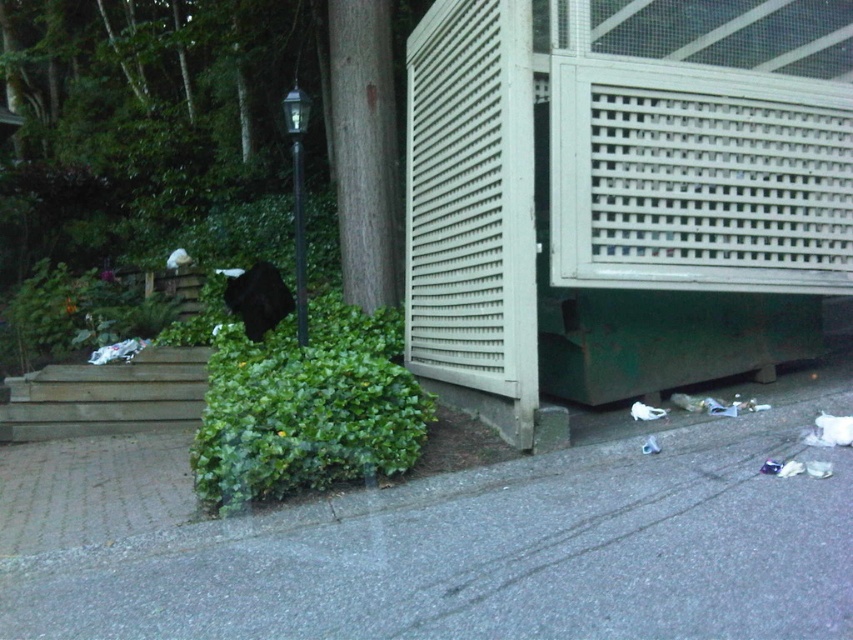
In the scene shown: You are standing at the point marked by the coordinates point (614, 205), which is the green textured porch at lower right. Looking around, you notice a black lamppost. In which direction relative to your current position is the black lamppost located?

The black lamppost is to the left of the green textured porch at lower right.

You are a delivery robot that needs to move a large package from the gray concrete pavement at lower center to the wooden stairs at lower left. Can you fit the package through the space between them?

The gray concrete pavement at lower center might be wider than wooden stairs at lower left, so there is a possibility that the space between them is wide enough for the package. However, the exact width isn